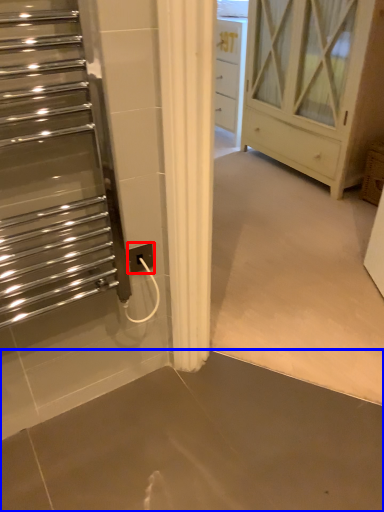
Question: Which object appears closest to the camera in this image, electric outlet (highlighted by a red box) or concrete (highlighted by a blue box)?

Choices:
 (A) electric outlet
 (B) concrete

Answer: (B)